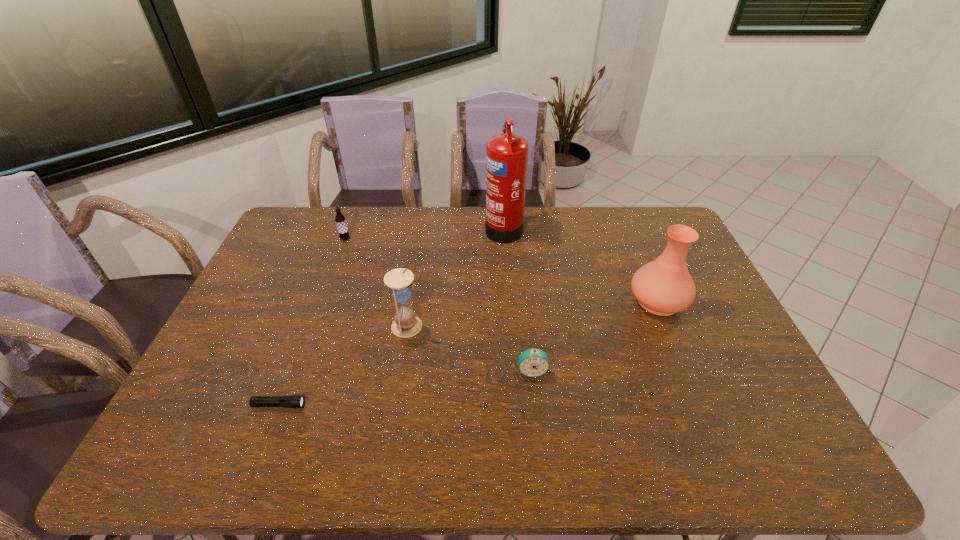
Locate an element on the screen. object present at the right edge is located at coordinates (664, 286).

Locate an element on the screen. This screenshot has width=960, height=540. free space at the far edge of the desktop is located at coordinates (568, 215).

Find the location of a particular element. The height and width of the screenshot is (540, 960). vacant space at the near edge of the desktop is located at coordinates (725, 458).

Find the location of a particular element. This screenshot has height=540, width=960. free point at the left edge is located at coordinates coord(314,247).

In the image, there is a desktop. Find the location of `vacant space at the far right corner`. vacant space at the far right corner is located at coordinates (650, 239).

Where is `empty space that is in between the root beer and the fifth farthest object`? This screenshot has height=540, width=960. empty space that is in between the root beer and the fifth farthest object is located at coordinates (439, 305).

In order to click on vacant region between the second tallest object and the shortest object in this screenshot , I will do `click(468, 353)`.

Where is `free space between the root beer and the second shortest object`? This screenshot has width=960, height=540. free space between the root beer and the second shortest object is located at coordinates (439, 305).

Identify the location of vacant point located between the nearest object and the fire extinguisher. This screenshot has height=540, width=960. (392, 316).

You are a GUI agent. You are given a task and a screenshot of the screen. Output one action in this format:
    pyautogui.click(x=<x>, y=<y>)
    Task: Click on the vacant area between the root beer and the vase
    The height and width of the screenshot is (540, 960).
    Given the screenshot: What is the action you would take?
    pyautogui.click(x=502, y=270)